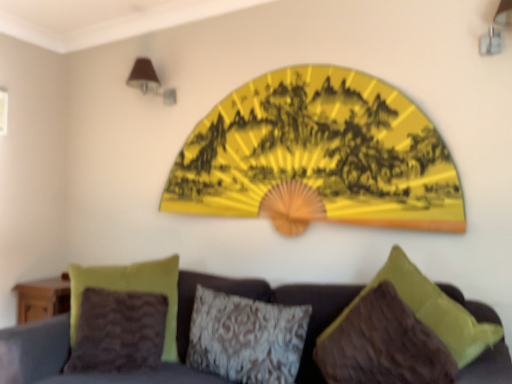
Question: From the image's perspective, is brown fabric lampshade at upper left on velvet fabric couch at center?

Choices:
 (A) no
 (B) yes

Answer: (B)

Question: Does brown fabric lampshade at upper left have a smaller size compared to velvet fabric couch at center?

Choices:
 (A) no
 (B) yes

Answer: (B)

Question: Is brown fabric lampshade at upper left not close to velvet fabric couch at center?

Choices:
 (A) no
 (B) yes

Answer: (B)

Question: Could velvet fabric couch at center be considered to be inside brown fabric lampshade at upper left?

Choices:
 (A) yes
 (B) no

Answer: (B)

Question: Is brown fabric lampshade at upper left positioned before velvet fabric couch at center?

Choices:
 (A) no
 (B) yes

Answer: (A)

Question: Is yellow paper fan at upper center in front of or behind velvet fabric couch at center in the image?

Choices:
 (A) front
 (B) behind

Answer: (B)

Question: Do you think yellow paper fan at upper center is within velvet fabric couch at center, or outside of it?

Choices:
 (A) inside
 (B) outside

Answer: (B)

Question: In terms of size, does yellow paper fan at upper center appear bigger or smaller than velvet fabric couch at center?

Choices:
 (A) big
 (B) small

Answer: (B)

Question: Based on their positions, is yellow paper fan at upper center located to the left or right of velvet fabric couch at center?

Choices:
 (A) left
 (B) right

Answer: (B)

Question: In terms of height, does velvet fabric couch at center look taller or shorter compared to yellow paper fan at upper center?

Choices:
 (A) short
 (B) tall

Answer: (A)

Question: In terms of width, does velvet fabric couch at center look wider or thinner when compared to yellow paper fan at upper center?

Choices:
 (A) thin
 (B) wide

Answer: (B)

Question: From a real-world perspective, is velvet fabric couch at center positioned above or below yellow paper fan at upper center?

Choices:
 (A) below
 (B) above

Answer: (A)

Question: Based on their sizes in the image, would you say velvet fabric couch at center is bigger or smaller than yellow paper fan at upper center?

Choices:
 (A) small
 (B) big

Answer: (B)

Question: Considering the positions of point (467, 375) and point (226, 350), is point (467, 375) closer or farther from the camera than point (226, 350)?

Choices:
 (A) closer
 (B) farther

Answer: (A)

Question: Is velvet fabric couch at center in front of or behind textured gray pillow at center, the second pillow when ordered from right to left, in the image?

Choices:
 (A) front
 (B) behind

Answer: (A)